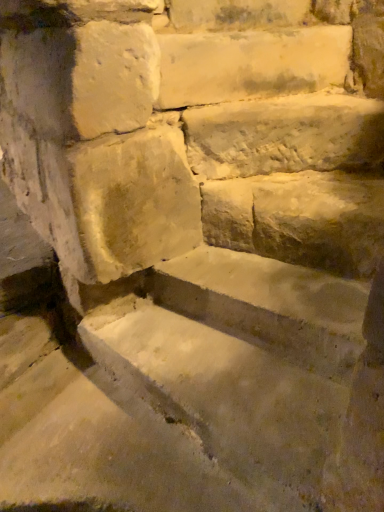
Question: Can you confirm if white stone step at upper center, which ranks as the first limestone in top-to-bottom order, is shorter than smooth stone brick at upper center?

Choices:
 (A) no
 (B) yes

Answer: (A)

Question: Does white stone step at upper center, the 2th limestone positioned from the bottom, contain smooth stone brick at upper center?

Choices:
 (A) yes
 (B) no

Answer: (B)

Question: Is white stone step at upper center, which ranks as the first limestone in top-to-bottom order, facing towards smooth stone brick at upper center?

Choices:
 (A) no
 (B) yes

Answer: (A)

Question: From the image's perspective, is white stone step at upper center, the 2th limestone positioned from the bottom, over smooth stone brick at upper center?

Choices:
 (A) yes
 (B) no

Answer: (B)

Question: Is white stone step at upper center, which ranks as the first limestone in top-to-bottom order, wider than smooth stone brick at upper center?

Choices:
 (A) no
 (B) yes

Answer: (B)

Question: From their relative heights in the image, would you say smooth stone brick at upper center is taller or shorter than white rough stone at center, acting as the 1th limestone starting from the bottom?

Choices:
 (A) short
 (B) tall

Answer: (A)

Question: In the image, is smooth stone brick at upper center on the left side or the right side of white rough stone at center, which is the 2th limestone in top-to-bottom order?

Choices:
 (A) left
 (B) right

Answer: (A)

Question: Relative to white rough stone at center, which is the 2th limestone in top-to-bottom order, is smooth stone brick at upper center in front or behind?

Choices:
 (A) front
 (B) behind

Answer: (B)

Question: From a real-world perspective, is smooth stone brick at upper center positioned above or below white rough stone at center, which is the 2th limestone in top-to-bottom order?

Choices:
 (A) above
 (B) below

Answer: (A)

Question: Based on their positions, is white stone step at upper center, the 2th limestone positioned from the bottom, located to the left or right of white rough stone at center, which is the 2th limestone in top-to-bottom order?

Choices:
 (A) left
 (B) right

Answer: (A)

Question: Does point (238, 56) appear closer or farther from the camera than point (233, 124)?

Choices:
 (A) farther
 (B) closer

Answer: (A)

Question: Is white stone step at upper center, which ranks as the first limestone in top-to-bottom order, inside or outside of white rough stone at center, which is the 2th limestone in top-to-bottom order?

Choices:
 (A) outside
 (B) inside

Answer: (A)

Question: From their relative heights in the image, would you say white stone step at upper center, which ranks as the first limestone in top-to-bottom order, is taller or shorter than white rough stone at center, which is the 2th limestone in top-to-bottom order?

Choices:
 (A) tall
 (B) short

Answer: (A)

Question: Do you think white stone step at upper center, the 2th limestone positioned from the bottom, is within smooth stone brick at upper center, or outside of it?

Choices:
 (A) outside
 (B) inside

Answer: (A)

Question: From their relative heights in the image, would you say white stone step at upper center, which ranks as the first limestone in top-to-bottom order, is taller or shorter than smooth stone brick at upper center?

Choices:
 (A) tall
 (B) short

Answer: (A)